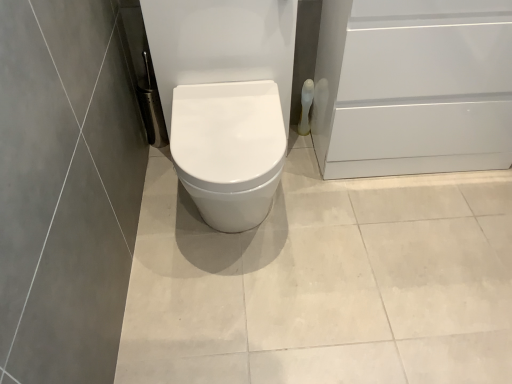
Question: Relative to white glossy toilet paper at right, is white glossy screen door at right in front or behind?

Choices:
 (A) behind
 (B) front

Answer: (B)

Question: Based on their sizes in the image, would you say white glossy screen door at right is bigger or smaller than white glossy toilet paper at right?

Choices:
 (A) big
 (B) small

Answer: (A)

Question: In the image, is white glossy screen door at right on the left side or the right side of white glossy toilet paper at right?

Choices:
 (A) right
 (B) left

Answer: (A)

Question: In the image, is white glossy toilet paper at right on the left side or the right side of white glossy screen door at right?

Choices:
 (A) right
 (B) left

Answer: (B)

Question: Do you think white glossy toilet paper at right is within white glossy screen door at right, or outside of it?

Choices:
 (A) outside
 (B) inside

Answer: (A)

Question: From the image's perspective, is white glossy toilet paper at right positioned above or below white glossy screen door at right?

Choices:
 (A) above
 (B) below

Answer: (B)

Question: From a real-world perspective, relative to white glossy screen door at right, is white glossy toilet paper at right vertically above or below?

Choices:
 (A) above
 (B) below

Answer: (B)